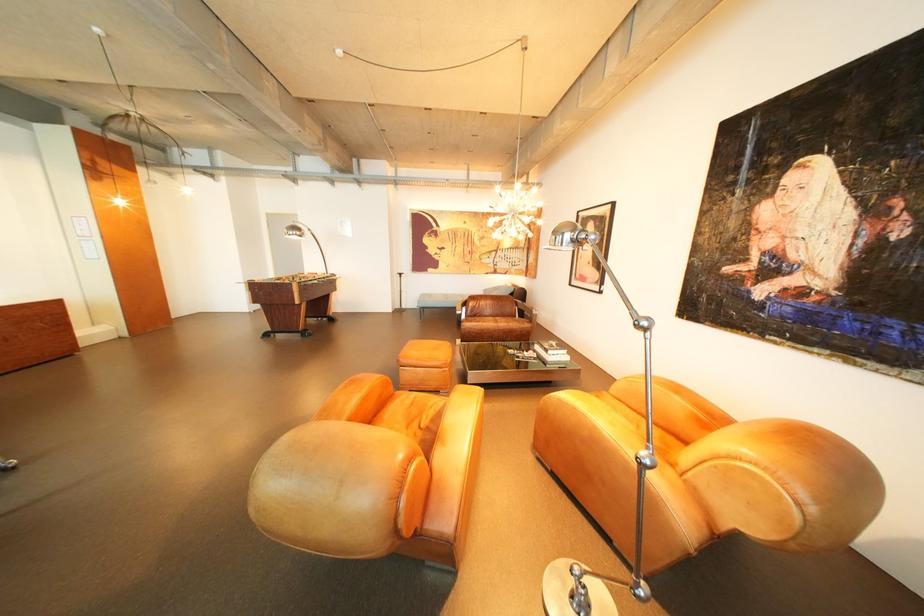
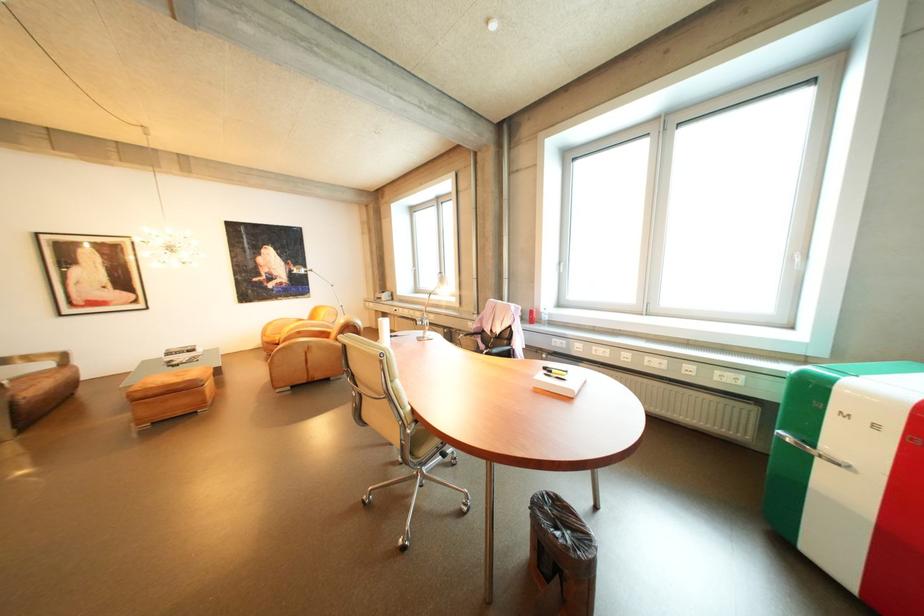
Find the pixel in the second image that matches point 864,215 in the first image.

(296, 264)